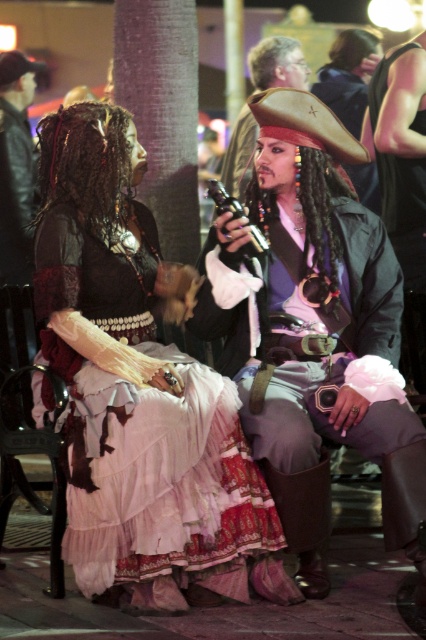
This screenshot has height=640, width=426. Describe the element at coordinates (316, 314) in the screenshot. I see `leather pirate hat at center` at that location.

Does leather pirate hat at center have a lesser width compared to shiny black vest at right?

No.

Where is `leather pirate hat at center`? The image size is (426, 640). leather pirate hat at center is located at coordinates (316, 314).

Does leather pirate hat at center have a larger size compared to shiny gold pirate hat at center?

Yes.

Is point (394, 353) positioned before point (250, 115)?

That is True.

This screenshot has height=640, width=426. I want to click on leather pirate hat at center, so click(316, 314).

Is point (241, 550) positioned after point (285, 77)?

No, (241, 550) is closer to viewer.

Where is `ruffled lace dress at center`? ruffled lace dress at center is located at coordinates (140, 392).